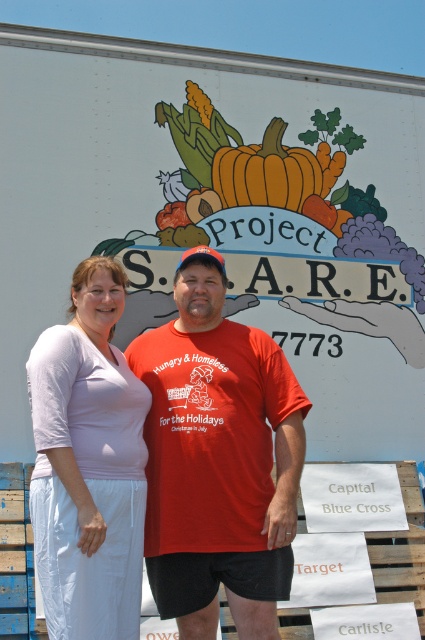
Question: Considering the real-world distances, which object is farthest from the matte red t-shirt at center?

Choices:
 (A) pale pink fabric shirt at center
 (B) orange matte pumpkin at center

Answer: (B)

Question: Is pale pink fabric shirt at center above orange matte pumpkin at center?

Choices:
 (A) no
 (B) yes

Answer: (A)

Question: Considering the real-world distances, which object is farthest from the matte red t-shirt at center?

Choices:
 (A) pale pink fabric shirt at center
 (B) orange matte pumpkin at center

Answer: (B)

Question: Which object is closer to the camera taking this photo?

Choices:
 (A) pale pink fabric shirt at center
 (B) orange matte pumpkin at center
 (C) matte red t-shirt at center

Answer: (A)

Question: Is matte red t-shirt at center closer to camera compared to pale pink fabric shirt at center?

Choices:
 (A) no
 (B) yes

Answer: (A)

Question: Considering the relative positions of matte red t-shirt at center and orange matte pumpkin at center in the image provided, where is matte red t-shirt at center located with respect to orange matte pumpkin at center?

Choices:
 (A) above
 (B) below

Answer: (B)